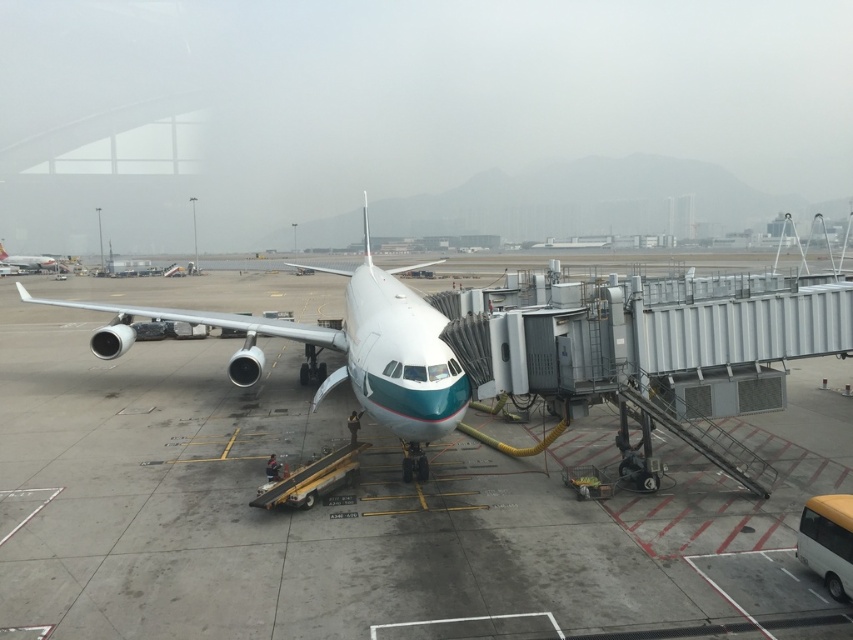
You are a passenger waiting to board your flight. You see the gray concrete tarmac at center and the white glossy airplane at upper left. Which object is lower in position?

The gray concrete tarmac at center is located below the white glossy airplane at upper left, so the gray concrete tarmac at center is lower in position.

You are standing at the jet bridge entrance and want to take a photo of the airplane. Which of the two points, point (195,608) or point (10,262), will appear larger in your camera view?

Point (195,608) will appear larger in your camera view because it is closer to the camera than point (10,262).